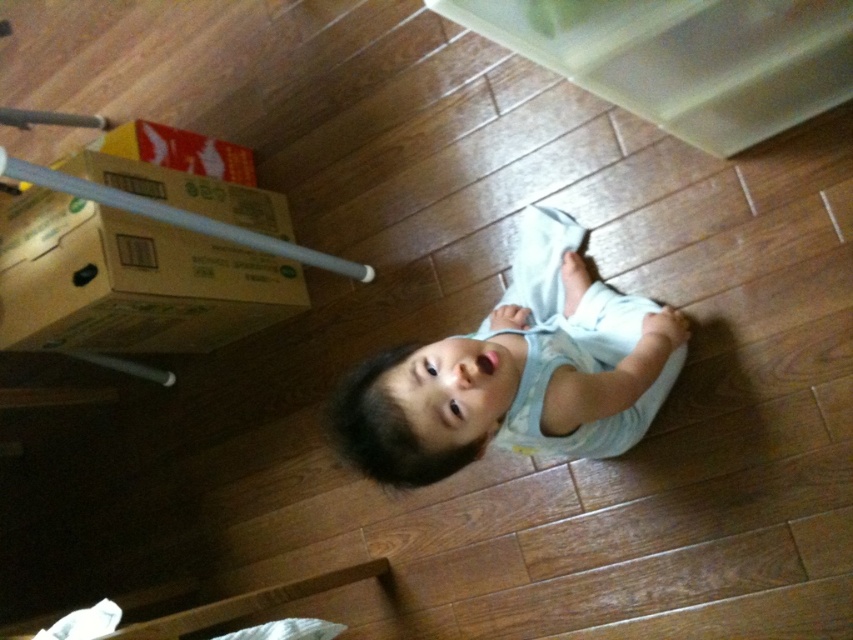
You are a parent trying to ensure your child is safe. You see the light blue fabric at center and the green cardboard box at left in the room. Which object is closer to the child?

The light blue fabric at center is closer to the viewer than the green cardboard box at left, so the light blue fabric at center is closer to the child.

You are a parent trying to place a new toy on the floor. The light blue fabric at center and the green cardboard box at left are already there. Which object takes up more space on the floor?

The light blue fabric at center takes up more space on the floor since it is bigger than the green cardboard box at left.

You are a parent trying to place a new toy on the wooden floor. The toy requires a space larger than the green cardboard box at left. Can the light blue fabric at center accommodate the toy?

The light blue fabric at center has a larger width than the green cardboard box at left, so it can accommodate the toy that requires a space larger than the green cardboard box at left.